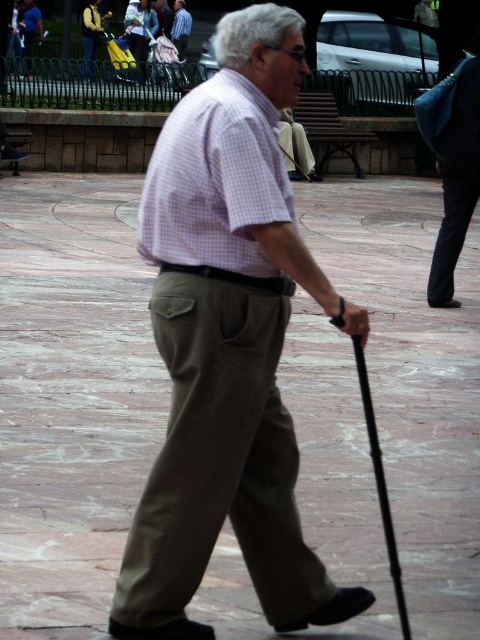
Question: Is brown stone pavement at center smaller than purple checkered shirt at center?

Choices:
 (A) yes
 (B) no

Answer: (B)

Question: Among these points, which one is farthest from the camera?

Choices:
 (A) (160, 163)
 (B) (180, 45)

Answer: (B)

Question: Does brown stone pavement at center have a larger size compared to light blue shirt at center?

Choices:
 (A) no
 (B) yes

Answer: (B)

Question: Can you confirm if purple checkered shirt at center is wider than light blue shirt at center?

Choices:
 (A) no
 (B) yes

Answer: (A)

Question: Among these points, which one is nearest to the camera?

Choices:
 (A) (314, 576)
 (B) (93, 257)
 (C) (182, 35)
 (D) (251, 269)

Answer: (D)

Question: Which point is closer to the camera?

Choices:
 (A) coord(194,412)
 (B) coord(204,236)
 (C) coord(181,6)

Answer: (A)